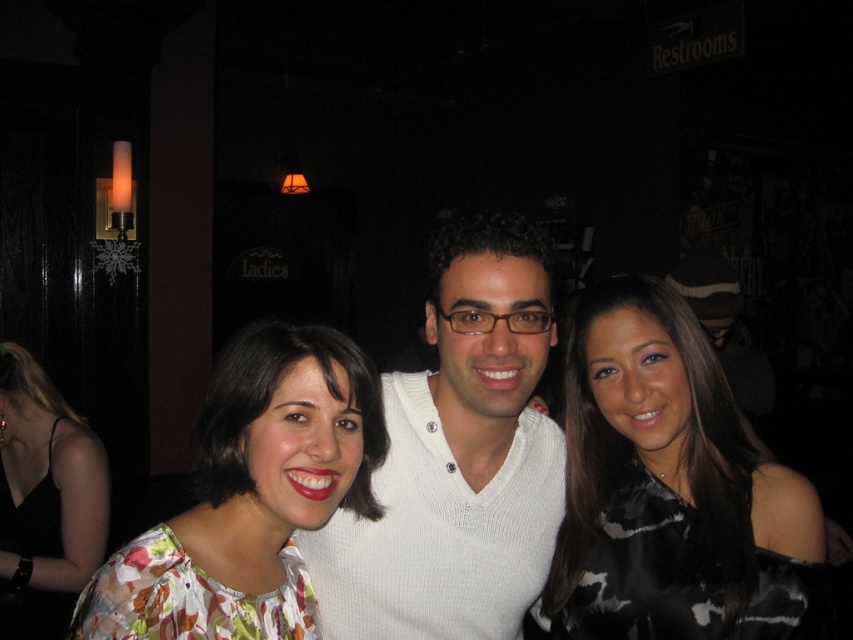
Which is above, white knitted sweater at center or floral fabric blouse at center?

Positioned higher is white knitted sweater at center.

Can you confirm if white knitted sweater at center is positioned to the left of floral fabric blouse at center?

In fact, white knitted sweater at center is to the right of floral fabric blouse at center.

What are the coordinates of `white knitted sweater at center` in the screenshot? It's located at (457, 460).

Identify the location of white knitted sweater at center. This screenshot has width=853, height=640. (457, 460).

Can you confirm if black satin dress at center is positioned to the right of white knitted sweater at center?

Indeed, black satin dress at center is positioned on the right side of white knitted sweater at center.

Between point (589, 572) and point (518, 465), which one is positioned in front?

Point (589, 572) is more forward.

This screenshot has height=640, width=853. What do you see at coordinates (666, 490) in the screenshot?
I see `black satin dress at center` at bounding box center [666, 490].

Find the location of a particular element. black satin dress at center is located at coordinates (666, 490).

Is floral fabric blouse at center thinner than floral fabric dress at center?

Indeed, floral fabric blouse at center has a lesser width compared to floral fabric dress at center.

Between point (157, 560) and point (106, 461), which one is positioned behind?

Positioned behind is point (106, 461).

Measure the distance between floral fabric blouse at center and camera.

floral fabric blouse at center is 31.86 inches away from camera.

The height and width of the screenshot is (640, 853). What are the coordinates of `floral fabric blouse at center` in the screenshot? It's located at (251, 496).